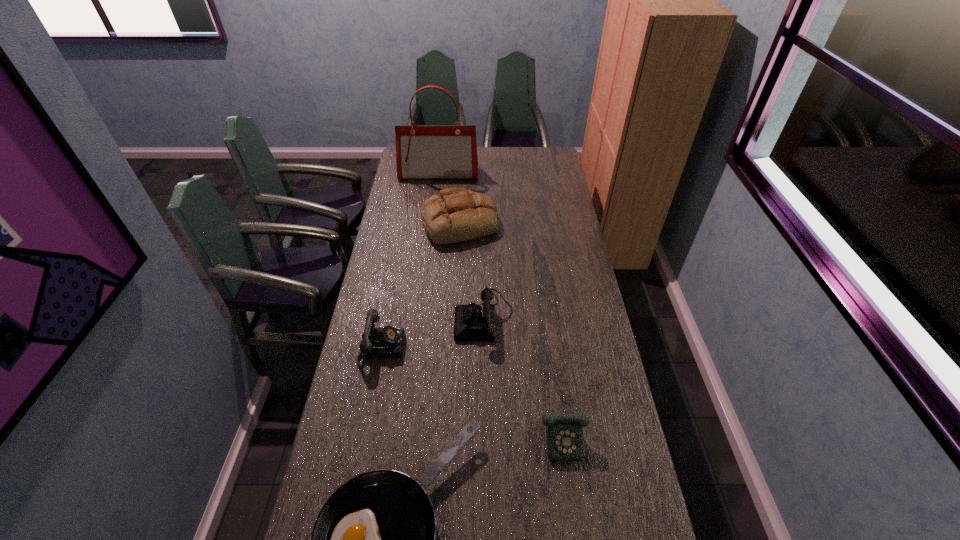
Identify the location of free space located 0.080m on the front face of the second telephone from right to left. The height and width of the screenshot is (540, 960). (433, 317).

Where is `free region located 0.080m on the front face of the second telephone from right to left`? free region located 0.080m on the front face of the second telephone from right to left is located at coordinates (433, 317).

I want to click on free spot located on the front face of the second telephone from right to left, so click(369, 317).

Identify the location of vacant region located 0.060m on the dial of the leftmost telephone. Image resolution: width=960 pixels, height=540 pixels. (421, 349).

In order to click on free space located 0.080m on the dial of the shortest telephone in this screenshot , I will do `click(583, 491)`.

Where is `object located at the far edge`? object located at the far edge is located at coordinates (422, 151).

The width and height of the screenshot is (960, 540). Identify the location of handbag at the left edge. (422, 151).

The image size is (960, 540). I want to click on bread at the left edge, so click(x=454, y=215).

Where is `telephone that is at the left edge`? telephone that is at the left edge is located at coordinates (382, 342).

The width and height of the screenshot is (960, 540). Find the location of `object located in the right edge section of the desktop`. object located in the right edge section of the desktop is located at coordinates pos(564,432).